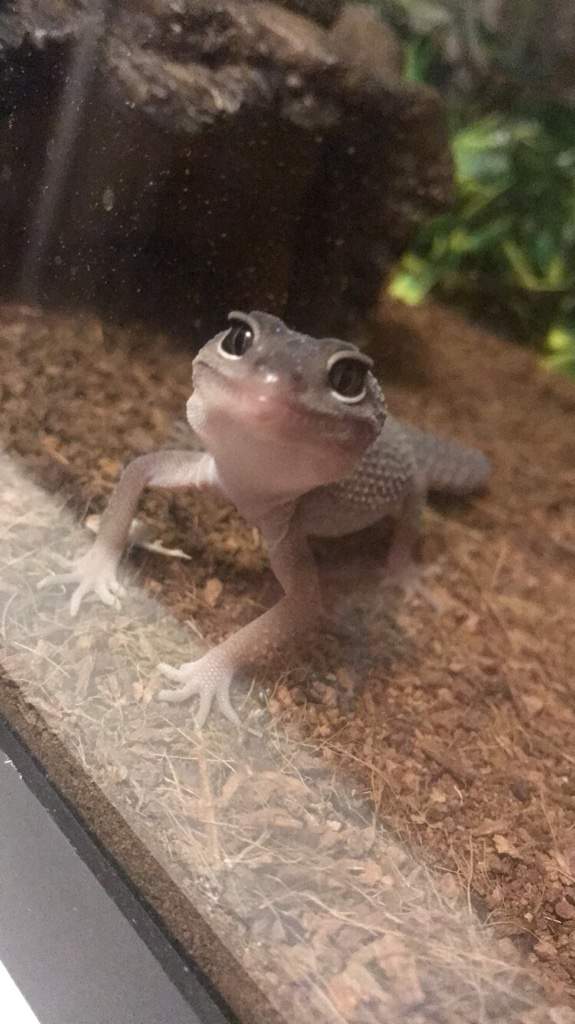
Where is `bedding`? The height and width of the screenshot is (1024, 575). bedding is located at coordinates (415, 701).